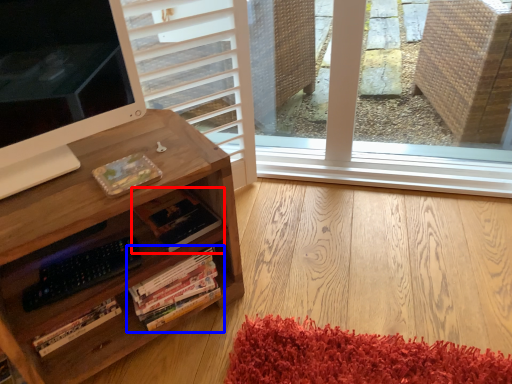
Question: Which of the following is the farthest to the observer, book (highlighted by a red box) or book (highlighted by a blue box)?

Choices:
 (A) book
 (B) book

Answer: (A)